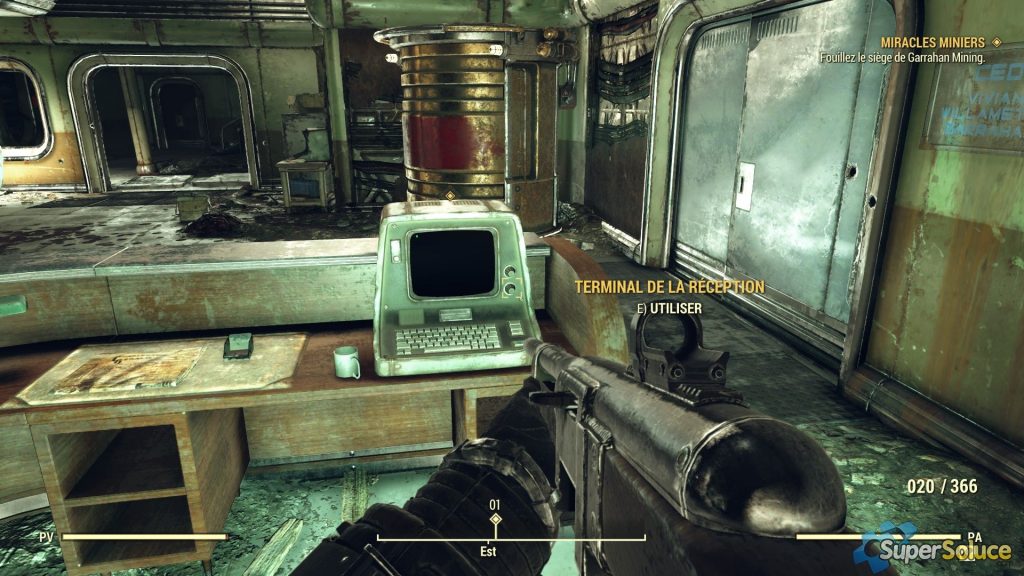
You are a GUI agent. You are given a task and a screenshot of the screen. Output one action in this format:
    pyautogui.click(x=<x>, y=<y>)
    Task: Click on the metal doors
    The height and width of the screenshot is (576, 1024).
    Given the screenshot: What is the action you would take?
    coord(802,138), coord(713,107)